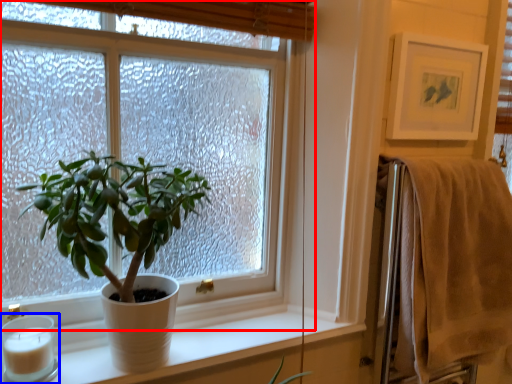
Question: Which object appears closest to the camera in this image, window (highlighted by a red box) or candle holder (highlighted by a blue box)?

Choices:
 (A) window
 (B) candle holder

Answer: (A)